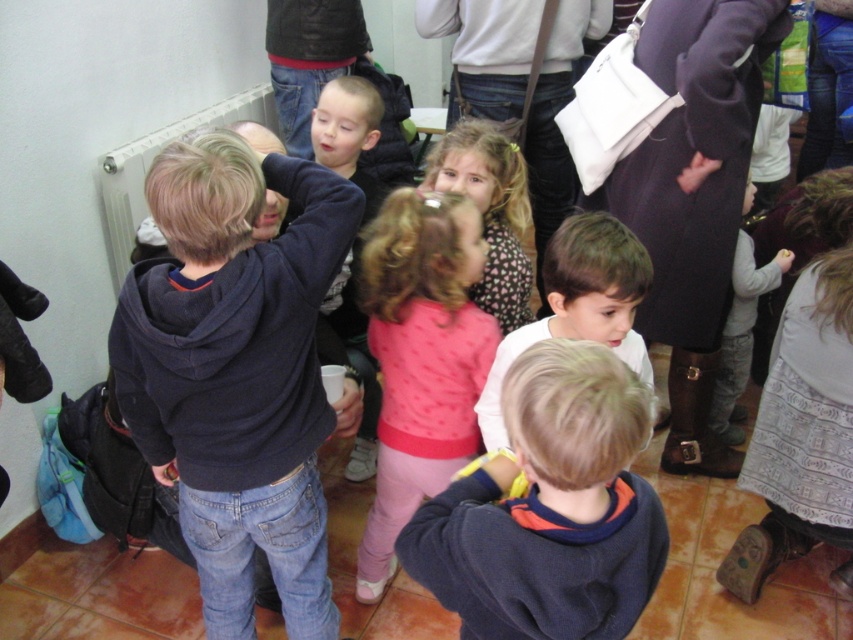
You are a photographer trying to capture a clear photo of the dark blue sweatshirt at center without the dark blue hoodie at center blocking it. What should you do?

The dark blue hoodie at center is positioned over dark blue sweatshirt at center, so you should move the dark blue hoodie at center out of the way to get a clear shot of the dark blue sweatshirt at center.

In the scene described, there are two children wearing the dark blue hoodie at center and the pink fabric dress at center. Which child is taller?

The dark blue hoodie at center is much taller than the pink fabric dress at center.

Where is the dark blue hoodie at center located in the image?

The dark blue hoodie at center is located at point (236, 371) in the image.